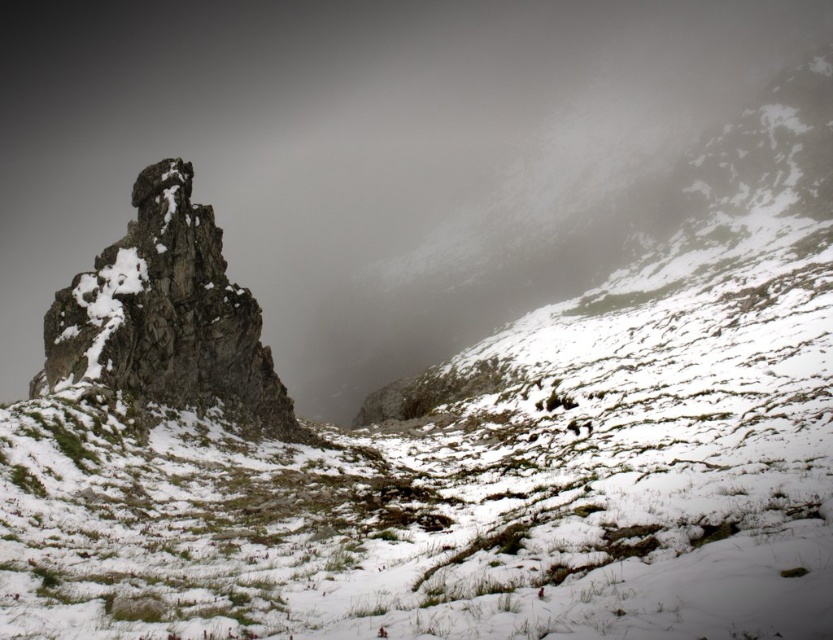
You are an observer standing at the base of the mountain. You notice the white foggy cloud at upper center and the rough stone rock at left. Which object is wider in the image?

The white foggy cloud at upper center might be wider than rough stone rock at left according to the description.